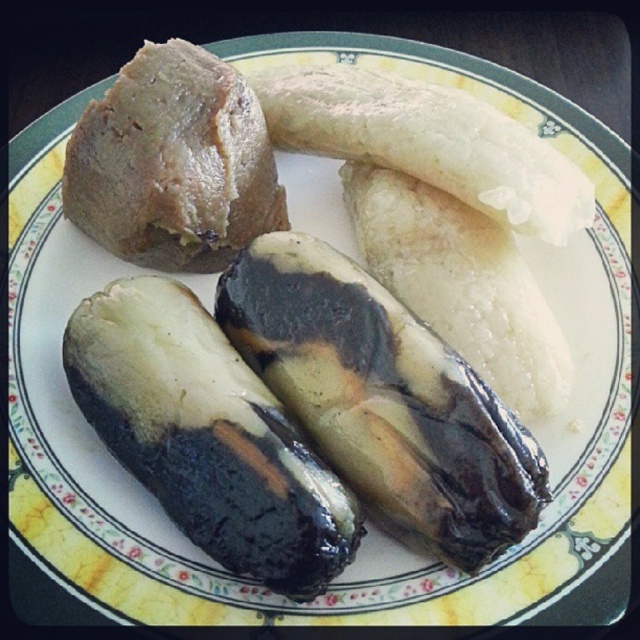
Question: Can you confirm if black glossy eggplant at center is thinner than white creamy banana at upper right?

Choices:
 (A) yes
 (B) no

Answer: (A)

Question: Which object appears farthest from the camera in this image?

Choices:
 (A) black glossy eggplant at center
 (B) matte brown rice cake at upper left
 (C) charcoal-black eggplant at center
 (D) white matte banana at upper center

Answer: (B)

Question: Among these points, which one is nearest to the camera?

Choices:
 (A) (128, 352)
 (B) (362, 84)
 (C) (173, 240)
 (D) (436, 216)

Answer: (A)

Question: Is matte brown rice cake at upper left thinner than white creamy banana at upper right?

Choices:
 (A) yes
 (B) no

Answer: (A)

Question: Which object is the closest to the white matte banana at upper center?

Choices:
 (A) black glossy eggplant at center
 (B) matte brown rice cake at upper left
 (C) white creamy banana at upper right

Answer: (C)

Question: Is black glossy eggplant at center below white creamy banana at upper right?

Choices:
 (A) no
 (B) yes

Answer: (B)